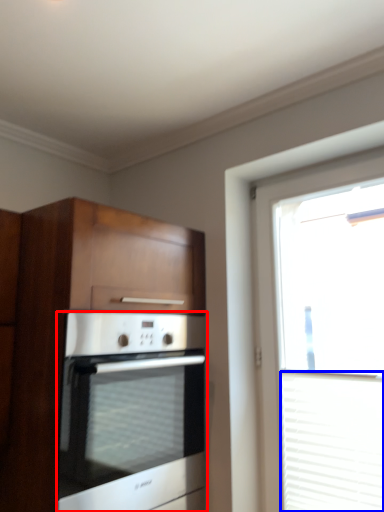
Question: Which object appears farthest to the camera in this image, oven (highlighted by a red box) or blind (highlighted by a blue box)?

Choices:
 (A) oven
 (B) blind

Answer: (B)